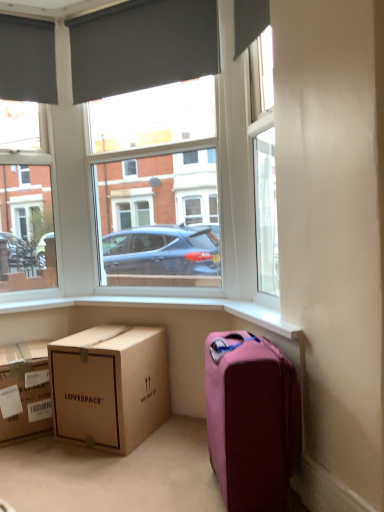
Question: From a real-world perspective, does white plastic window frame at upper center sit lower than matte black window at upper left?

Choices:
 (A) yes
 (B) no

Answer: (B)

Question: Can you confirm if white plastic window frame at upper center is thinner than matte black window at upper left?

Choices:
 (A) no
 (B) yes

Answer: (B)

Question: Considering the relative sizes of white plastic window frame at upper center and matte black window at upper left in the image provided, is white plastic window frame at upper center smaller than matte black window at upper left?

Choices:
 (A) yes
 (B) no

Answer: (B)

Question: Is white plastic window frame at upper center aimed at matte black window at upper left?

Choices:
 (A) yes
 (B) no

Answer: (B)

Question: Considering the relative sizes of white plastic window frame at upper center and matte black window at upper left in the image provided, is white plastic window frame at upper center taller than matte black window at upper left?

Choices:
 (A) no
 (B) yes

Answer: (B)

Question: Is white plastic window frame at upper center next to matte black window at upper left?

Choices:
 (A) yes
 (B) no

Answer: (B)

Question: From a real-world perspective, is brown cardboard box at lower left, the 1th box in the left-to-right sequence, located higher than pink fabric suitcase at lower right?

Choices:
 (A) yes
 (B) no

Answer: (B)

Question: Is brown cardboard box at lower left, the 1th box in the left-to-right sequence, thinner than pink fabric suitcase at lower right?

Choices:
 (A) no
 (B) yes

Answer: (A)

Question: Does brown cardboard box at lower left, the 1th box in the left-to-right sequence, have a greater width compared to pink fabric suitcase at lower right?

Choices:
 (A) yes
 (B) no

Answer: (A)

Question: Is brown cardboard box at lower left, the 1th box in the left-to-right sequence, closer to the viewer compared to pink fabric suitcase at lower right?

Choices:
 (A) yes
 (B) no

Answer: (B)

Question: Could you tell me if brown cardboard box at lower left, the second box viewed from the right, is turned towards pink fabric suitcase at lower right?

Choices:
 (A) yes
 (B) no

Answer: (B)

Question: Considering the relative sizes of brown cardboard box at lower left, the second box viewed from the right, and pink fabric suitcase at lower right in the image provided, is brown cardboard box at lower left, the second box viewed from the right, shorter than pink fabric suitcase at lower right?

Choices:
 (A) no
 (B) yes

Answer: (B)

Question: Is brown cardboard box at lower left, the second box viewed from the right, at the right side of white plastic window frame at upper center?

Choices:
 (A) no
 (B) yes

Answer: (A)